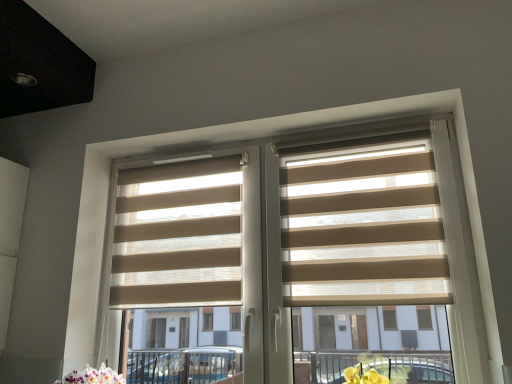
Question: Is beige fabric blinds at center, arranged as the 2th blind when viewed from the right, beside beige fabric blinds at center, the second blind from the left?

Choices:
 (A) no
 (B) yes

Answer: (A)

Question: Does beige fabric blinds at center, arranged as the 1th blind when viewed from the left, have a larger size compared to beige fabric blinds at center, which is the 1th blind from right to left?

Choices:
 (A) no
 (B) yes

Answer: (B)

Question: Is beige fabric blinds at center, arranged as the 2th blind when viewed from the right, facing towards beige fabric blinds at center, which is the 1th blind from right to left?

Choices:
 (A) no
 (B) yes

Answer: (A)

Question: Is beige fabric blinds at center, arranged as the 2th blind when viewed from the right, positioned with its back to beige fabric blinds at center, which is the 1th blind from right to left?

Choices:
 (A) yes
 (B) no

Answer: (B)

Question: Is beige fabric blinds at center, which is the 1th blind from right to left, completely or partially inside beige fabric blinds at center, arranged as the 2th blind when viewed from the right?

Choices:
 (A) yes
 (B) no

Answer: (B)

Question: Is beige fabric blinds at center, arranged as the 2th blind when viewed from the right, inside or outside of beige fabric blinds at center, the second blind from the left?

Choices:
 (A) outside
 (B) inside

Answer: (A)

Question: From a real-world perspective, relative to beige fabric blinds at center, which is the 1th blind from right to left, is beige fabric blinds at center, arranged as the 2th blind when viewed from the right, vertically above or below?

Choices:
 (A) below
 (B) above

Answer: (B)

Question: Considering their positions, is beige fabric blinds at center, arranged as the 2th blind when viewed from the right, located in front of or behind beige fabric blinds at center, which is the 1th blind from right to left?

Choices:
 (A) behind
 (B) front

Answer: (A)

Question: Would you say beige fabric blinds at center, arranged as the 1th blind when viewed from the left, is to the left or to the right of beige fabric blinds at center, the second blind from the left, in the picture?

Choices:
 (A) right
 (B) left

Answer: (B)

Question: From a real-world perspective, is beige fabric blinds at center, the second blind from the left, positioned above or below beige fabric blinds at center?

Choices:
 (A) above
 (B) below

Answer: (A)

Question: Do you think beige fabric blinds at center, the second blind from the left, is within beige fabric blinds at center, or outside of it?

Choices:
 (A) inside
 (B) outside

Answer: (A)

Question: From the image's perspective, is beige fabric blinds at center, which is the 1th blind from right to left, positioned above or below beige fabric blinds at center?

Choices:
 (A) above
 (B) below

Answer: (A)

Question: Considering their positions, is beige fabric blinds at center, the second blind from the left, located in front of or behind beige fabric blinds at center?

Choices:
 (A) behind
 (B) front

Answer: (A)

Question: In the image, is beige fabric blinds at center positioned in front of or behind beige fabric blinds at center, arranged as the 2th blind when viewed from the right?

Choices:
 (A) front
 (B) behind

Answer: (A)

Question: Which is correct: beige fabric blinds at center is inside beige fabric blinds at center, arranged as the 2th blind when viewed from the right, or outside of it?

Choices:
 (A) outside
 (B) inside

Answer: (A)